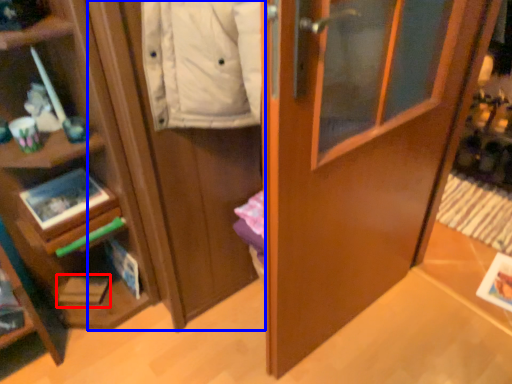
Question: Which object appears closest to the camera in this image, magazine (highlighted by a red box) or cabinetry (highlighted by a blue box)?

Choices:
 (A) magazine
 (B) cabinetry

Answer: (B)